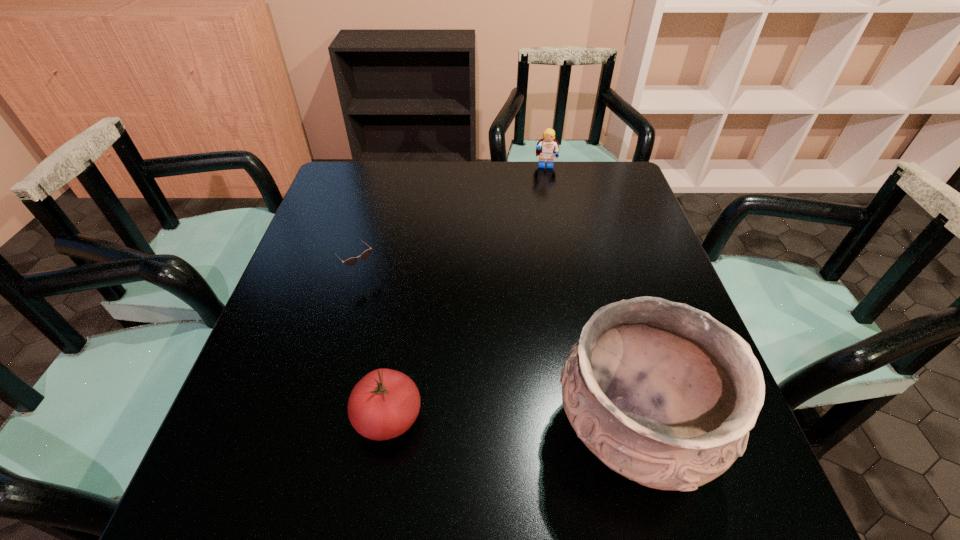
You are a GUI agent. You are given a task and a screenshot of the screen. Output one action in this format:
    pyautogui.click(x=<x>, y=<y>)
    Task: Click on the vacant space on the desktop that is between the tomato and the tallest object and is positioned in front of the lenses of the sunglasses
    
    Given the screenshot: What is the action you would take?
    pyautogui.click(x=505, y=424)

Locate an element on the screen. vacant space on the desktop that is between the tomato and the pottery and is positioned on the front-facing side of the Lego is located at coordinates (544, 427).